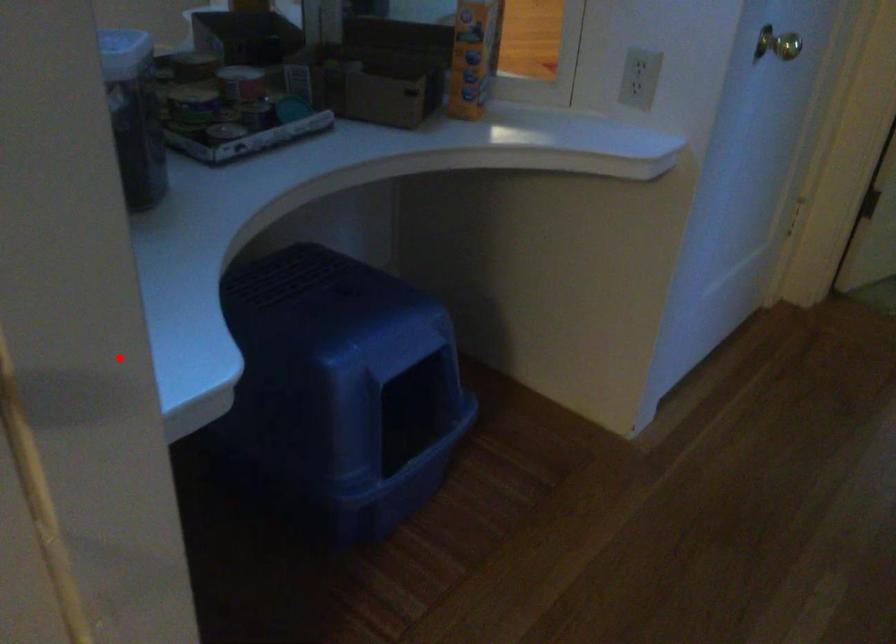
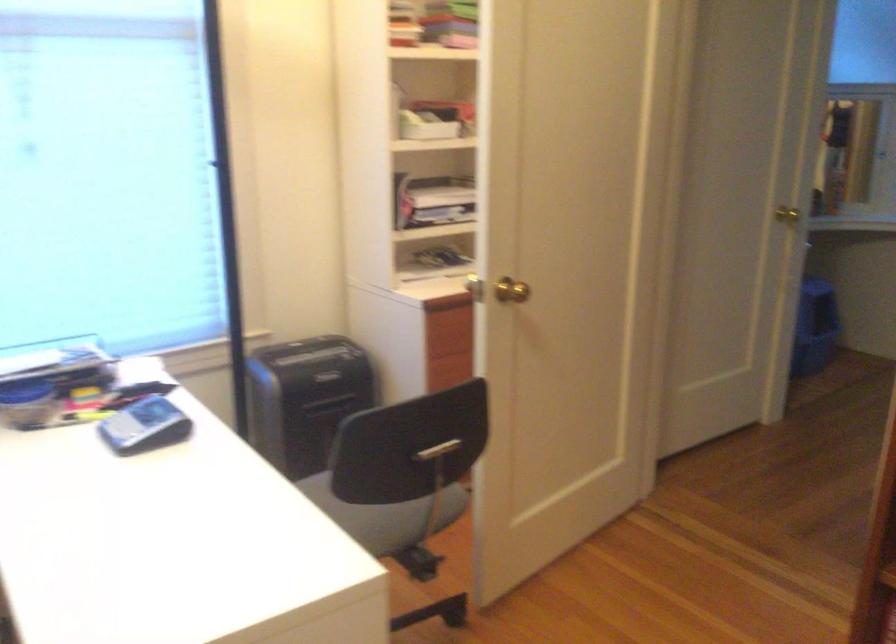
Question: I am providing you with two images of the same scene from different viewpoints. Image1 has a red point marked. In image2, the corresponding 3D location appears at what relative position? Reply with the corresponding letter.

Choices:
 (A) Closer
 (B) Farther

Answer: (B)